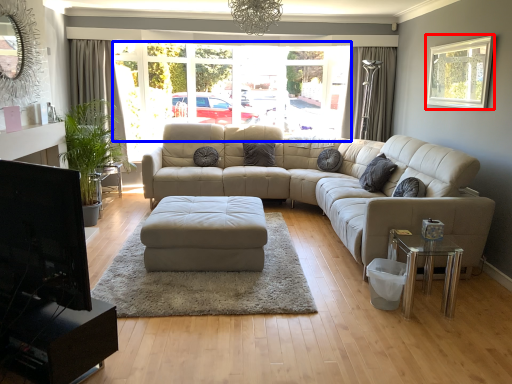
Question: Which object appears closest to the camera in this image, window (highlighted by a red box) or window frame (highlighted by a blue box)?

Choices:
 (A) window
 (B) window frame

Answer: (A)